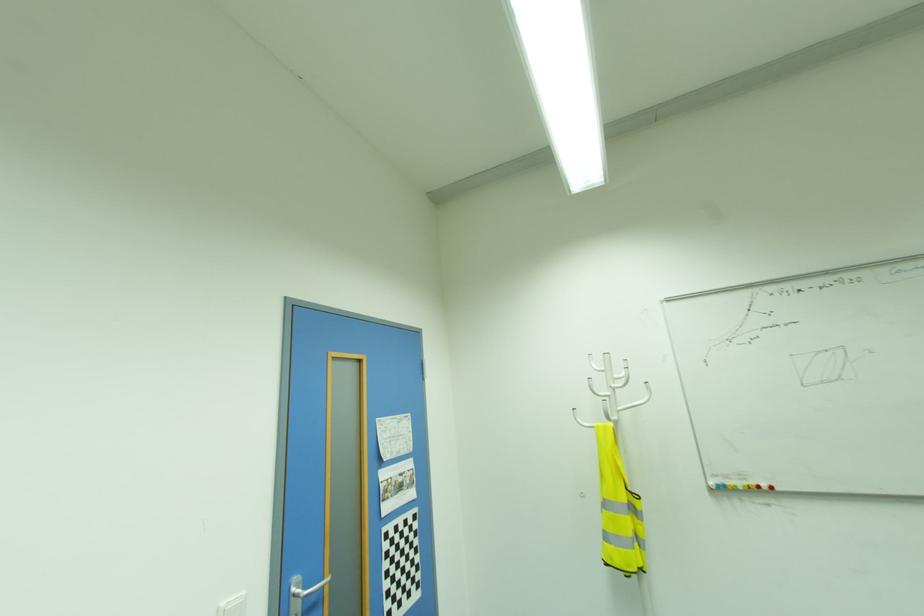
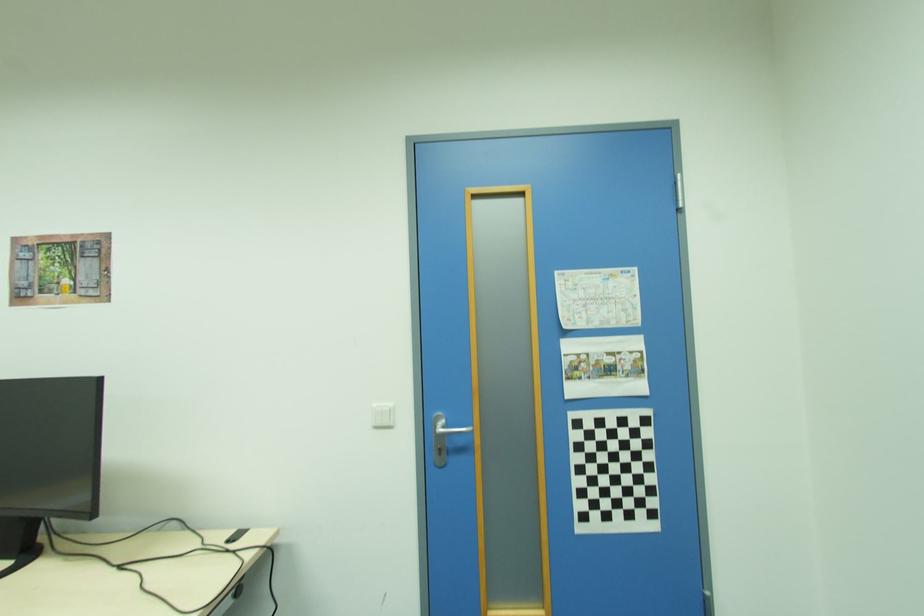
In the second image, find the point that corresponds to [390,491] in the first image.

(579, 369)